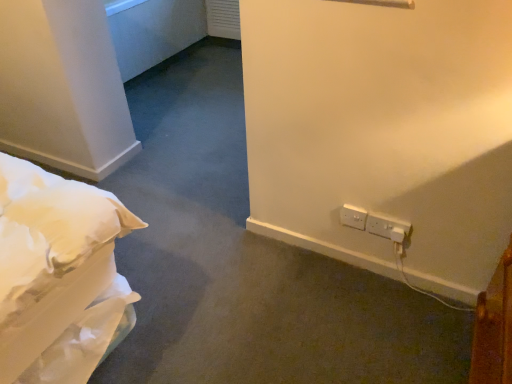
Question: Can you confirm if white plastic electric outlet at lower right, which is the first electric outlet from left to right, is positioned to the right of white plastic electrical outlet at lower right, the first electric outlet positioned from the right?

Choices:
 (A) no
 (B) yes

Answer: (A)

Question: Does white plastic electric outlet at lower right, the second electric outlet positioned from the right, have a greater width compared to white plastic electrical outlet at lower right, the first electric outlet positioned from the right?

Choices:
 (A) yes
 (B) no

Answer: (B)

Question: From the image's perspective, is white plastic electric outlet at lower right, which is the first electric outlet from left to right, over white plastic electrical outlet at lower right, the first electric outlet positioned from the right?

Choices:
 (A) yes
 (B) no

Answer: (A)

Question: Is white plastic electrical outlet at lower right, the first electric outlet positioned from the right, at the back of white plastic electric outlet at lower right, the second electric outlet positioned from the right?

Choices:
 (A) yes
 (B) no

Answer: (B)

Question: Is white plastic electric outlet at lower right, which is the first electric outlet from left to right, to the left of white plastic electrical outlet at lower right, the first electric outlet positioned from the right, from the viewer's perspective?

Choices:
 (A) yes
 (B) no

Answer: (A)

Question: Can you confirm if white plastic electric outlet at lower right, which is the first electric outlet from left to right, is smaller than white plastic electrical outlet at lower right, the first electric outlet positioned from the right?

Choices:
 (A) no
 (B) yes

Answer: (B)

Question: Is white plastic electric outlet at lower right, which is the first electric outlet from left to right, located within white plastic electrical outlet at lower right, the first electric outlet positioned from the right?

Choices:
 (A) yes
 (B) no

Answer: (B)

Question: From the image's perspective, is white plastic electrical outlet at lower right, the 2th electric outlet in the left-to-right sequence, located beneath white plastic electric outlet at lower right, which is the first electric outlet from left to right?

Choices:
 (A) no
 (B) yes

Answer: (B)

Question: Is white plastic electrical outlet at lower right, the 2th electric outlet in the left-to-right sequence, thinner than white plastic electric outlet at lower right, which is the first electric outlet from left to right?

Choices:
 (A) no
 (B) yes

Answer: (A)

Question: Is white plastic electrical outlet at lower right, the 2th electric outlet in the left-to-right sequence, positioned before white plastic electric outlet at lower right, which is the first electric outlet from left to right?

Choices:
 (A) no
 (B) yes

Answer: (B)

Question: Can we say white plastic electrical outlet at lower right, the first electric outlet positioned from the right, lies outside white plastic electric outlet at lower right, the second electric outlet positioned from the right?

Choices:
 (A) no
 (B) yes

Answer: (B)

Question: Is white plastic electrical outlet at lower right, the first electric outlet positioned from the right, to the right of white plastic electric outlet at lower right, the second electric outlet positioned from the right, from the viewer's perspective?

Choices:
 (A) no
 (B) yes

Answer: (B)

Question: Looking at their shapes, would you say white plastic electrical outlet at lower right, the first electric outlet positioned from the right, is wider or thinner than white plastic electric outlet at lower right, which is the first electric outlet from left to right?

Choices:
 (A) wide
 (B) thin

Answer: (A)